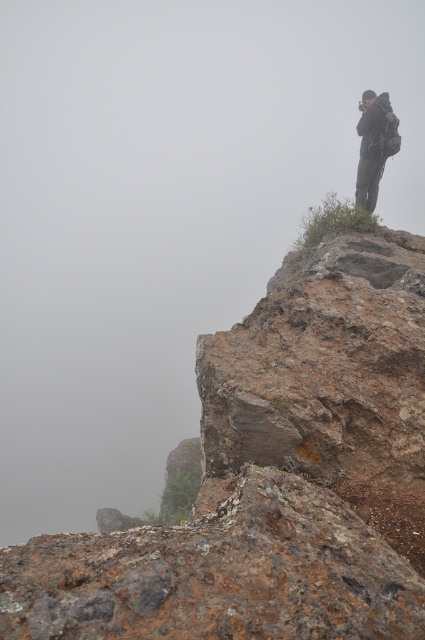
Is point (328, 387) closer to viewer compared to point (340, 541)?

No, it is not.

Who is positioned more to the right, rusty rock cliff at upper right or rusty rock at center?

From the viewer's perspective, rusty rock cliff at upper right appears more on the right side.

Does point (393, 616) come closer to viewer compared to point (402, 625)?

That is False.

At what (x,y) coordinates should I click in order to perform the action: click on rusty rock cliff at upper right. Please return your answer as a coordinate pair (x, y). This screenshot has height=640, width=425. Looking at the image, I should click on (274, 477).

Is point (405, 548) farther from viewer compared to point (377, 128)?

No, (405, 548) is closer to viewer.

Describe the element at coordinates (274, 477) in the screenshot. I see `rusty rock cliff at upper right` at that location.

You are a GUI agent. You are given a task and a screenshot of the screen. Output one action in this format:
    pyautogui.click(x=<x>, y=<y>)
    Task: Click on the rusty rock cliff at upper right
    
    Given the screenshot: What is the action you would take?
    pyautogui.click(x=274, y=477)

Between rusty rock at center and dark gray backpack at upper right, which one has more height?

dark gray backpack at upper right is taller.

Where is `rusty rock at center`? rusty rock at center is located at coordinates (218, 573).

Where is `rusty rock at center`? The image size is (425, 640). rusty rock at center is located at coordinates (218, 573).